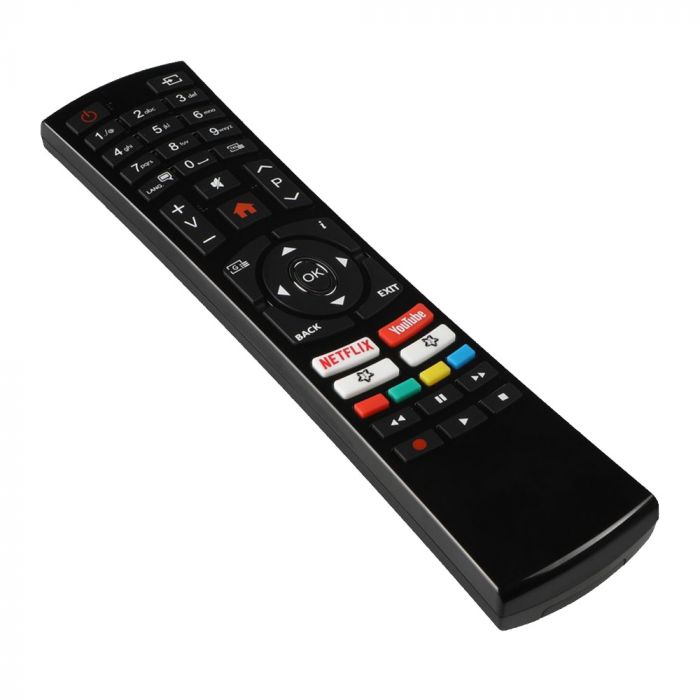
This screenshot has height=700, width=700. What are the coordinates of `control buttons` in the screenshot? It's located at (388, 420), (435, 399), (472, 378), (508, 396), (468, 421), (425, 440).